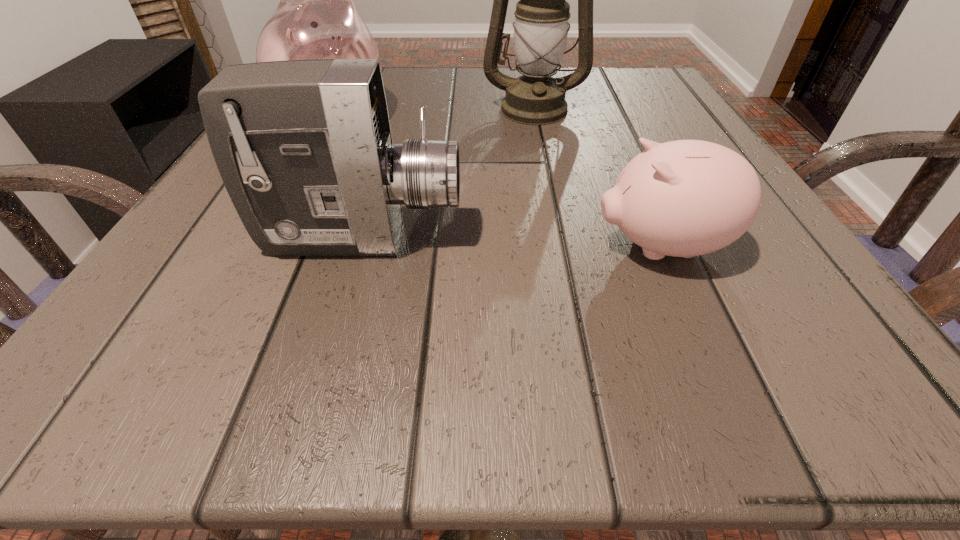
Locate an element on the screen. The width and height of the screenshot is (960, 540). vacant region at the near left corner of the desktop is located at coordinates (127, 398).

At what (x,y) coordinates should I click in order to perform the action: click on vacant region at the far right corner of the desktop. Please return your answer as a coordinate pair (x, y). The image size is (960, 540). Looking at the image, I should click on (665, 86).

At what (x,y) coordinates should I click in order to perform the action: click on free space at the near right corner. Please return your answer as a coordinate pair (x, y). Image resolution: width=960 pixels, height=540 pixels. Looking at the image, I should click on (840, 369).

Locate an element on the screen. Image resolution: width=960 pixels, height=540 pixels. vacant space that is in between the left piggy bank and the tallest object is located at coordinates (434, 113).

At what (x,y) coordinates should I click in order to perform the action: click on blank region between the shortest object and the left piggy bank. Please return your answer as a coordinate pair (x, y). Looking at the image, I should click on (497, 183).

The width and height of the screenshot is (960, 540). I want to click on vacant space in between the nearer piggy bank and the camcorder, so click(x=512, y=242).

Locate an element on the screen. The width and height of the screenshot is (960, 540). free space between the tallest object and the left piggy bank is located at coordinates (434, 113).

Find the location of a particular element. The height and width of the screenshot is (540, 960). blank region between the oil lamp and the nearer piggy bank is located at coordinates (596, 178).

Identify which object is the closest to the camcorder. Please provide its 2D coordinates. Your answer should be formatted as a tuple, i.e. [(x, y)], where the tuple contains the x and y coordinates of a point satisfying the conditions above.

[(684, 198)]

Where is `object that stands as the third closest to the shorter piggy bank`? object that stands as the third closest to the shorter piggy bank is located at coordinates (316, 18).